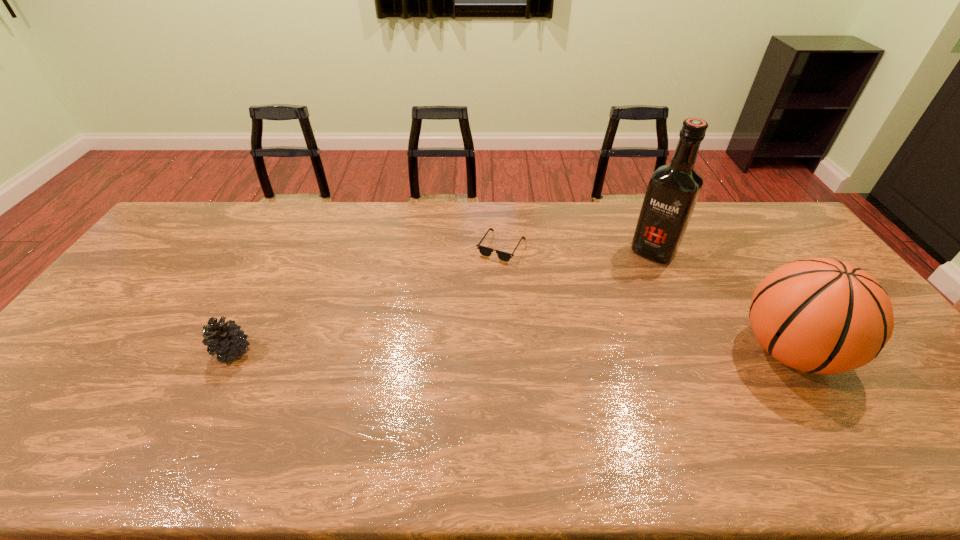
Identify the location of object at the near right corner. The image size is (960, 540). (818, 315).

Where is `vacant area at the far edge of the desktop`? Image resolution: width=960 pixels, height=540 pixels. vacant area at the far edge of the desktop is located at coordinates (432, 202).

Image resolution: width=960 pixels, height=540 pixels. In the image, there is a desktop. In order to click on free space at the near edge in this screenshot , I will do `click(814, 416)`.

Locate an element on the screen. This screenshot has height=540, width=960. free space at the left edge of the desktop is located at coordinates (175, 279).

In the image, there is a desktop. Where is `vacant space at the near left corner`? The image size is (960, 540). vacant space at the near left corner is located at coordinates (27, 408).

You are a GUI agent. You are given a task and a screenshot of the screen. Output one action in this format:
    pyautogui.click(x=<x>, y=<y>)
    Task: Click on the vacant space at the far right corner of the desktop
    
    Given the screenshot: What is the action you would take?
    pyautogui.click(x=777, y=231)

At what (x,y) coordinates should I click in order to perform the action: click on vacant area that lies between the third object from right to left and the second shortest object. Please return your answer as a coordinate pair (x, y). Looking at the image, I should click on (367, 299).

Locate an element on the screen. The width and height of the screenshot is (960, 540). blank region between the shortest object and the second shortest object is located at coordinates (367, 299).

The height and width of the screenshot is (540, 960). What are the coordinates of `blank region between the tallest object and the basketball` in the screenshot? It's located at (721, 301).

Find the location of a particular element. The image size is (960, 540). free space between the tallest object and the second shortest object is located at coordinates (x=443, y=301).